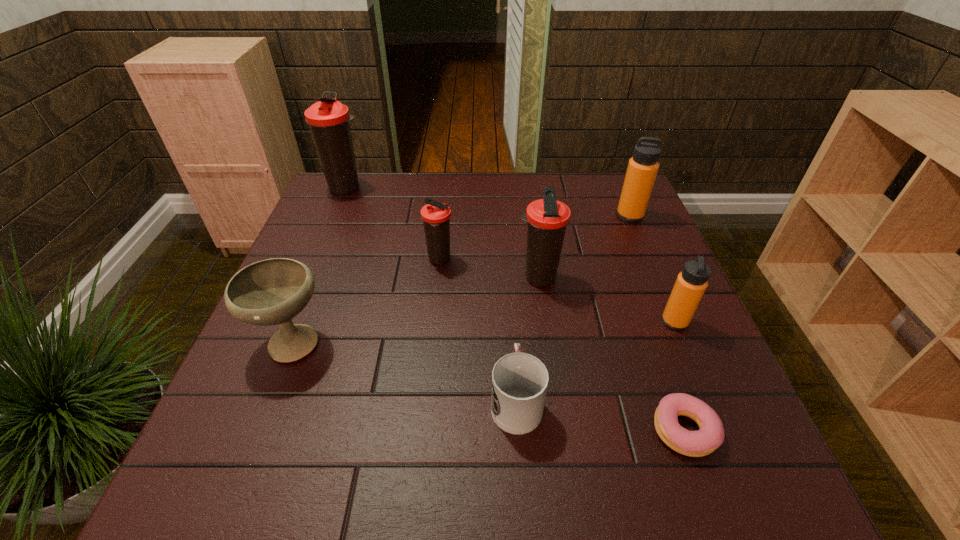
Locate an element on the screen. chalice is located at coordinates (269, 292).

Where is `cup`? The height and width of the screenshot is (540, 960). cup is located at coordinates (519, 381).

Where is `red cup`? This screenshot has width=960, height=540. red cup is located at coordinates (519, 381).

Locate an element on the screen. This screenshot has width=960, height=540. pink doughnut is located at coordinates (710, 436).

In order to click on doughnut in this screenshot , I will do `click(710, 436)`.

The height and width of the screenshot is (540, 960). I want to click on vacant area situated 0.060m on the right of the tallest thermos bottle, so click(x=387, y=187).

Find the location of a particular element. The image size is (960, 540). free space located on the back of the rightmost brown thermos bottle is located at coordinates (529, 214).

You are a GUI agent. You are given a task and a screenshot of the screen. Output one action in this format:
    pyautogui.click(x=<x>, y=<y>)
    Task: Click on the vacant space situated 0.250m on the front of the second farthest object
    The height and width of the screenshot is (540, 960).
    Given the screenshot: What is the action you would take?
    pyautogui.click(x=660, y=285)

At what (x,y) coordinates should I click in order to perform the action: click on free spot located 0.280m on the left of the second brown thermos bottle from right to left. Please return your answer as a coordinate pair (x, y). The width and height of the screenshot is (960, 540). Looking at the image, I should click on (317, 260).

Where is `vacant space located on the left of the nearest thermos bottle`? This screenshot has width=960, height=540. vacant space located on the left of the nearest thermos bottle is located at coordinates (608, 321).